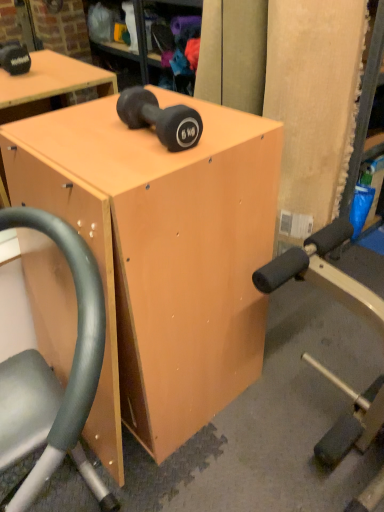
Where is `vacant region to the right of matte black dumbbell at center`? Image resolution: width=384 pixels, height=512 pixels. vacant region to the right of matte black dumbbell at center is located at coordinates (228, 129).